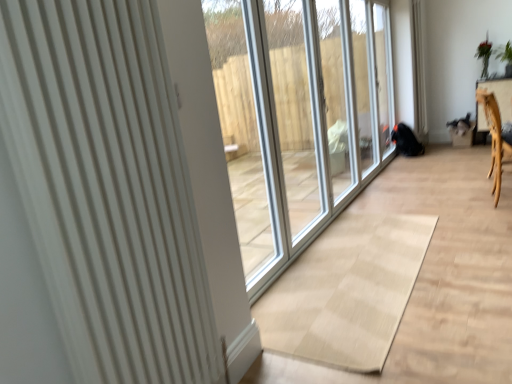
Question: Considering the positions of wooden armchair at right and white ribbed radiator at left in the image, is wooden armchair at right wider or thinner than white ribbed radiator at left?

Choices:
 (A) thin
 (B) wide

Answer: (B)

Question: Considering the positions of wooden armchair at right and white ribbed radiator at left in the image, is wooden armchair at right taller or shorter than white ribbed radiator at left?

Choices:
 (A) short
 (B) tall

Answer: (A)

Question: From a real-world perspective, relative to white ribbed radiator at left, is wooden armchair at right vertically above or below?

Choices:
 (A) above
 (B) below

Answer: (B)

Question: Would you say white ribbed radiator at left is inside or outside wooden armchair at right?

Choices:
 (A) outside
 (B) inside

Answer: (A)

Question: In terms of height, does white ribbed radiator at left look taller or shorter compared to wooden armchair at right?

Choices:
 (A) short
 (B) tall

Answer: (B)

Question: Is white ribbed radiator at left in front of or behind wooden armchair at right in the image?

Choices:
 (A) behind
 (B) front

Answer: (B)

Question: Considering the positions of white ribbed radiator at left and wooden armchair at right in the image, is white ribbed radiator at left bigger or smaller than wooden armchair at right?

Choices:
 (A) small
 (B) big

Answer: (A)